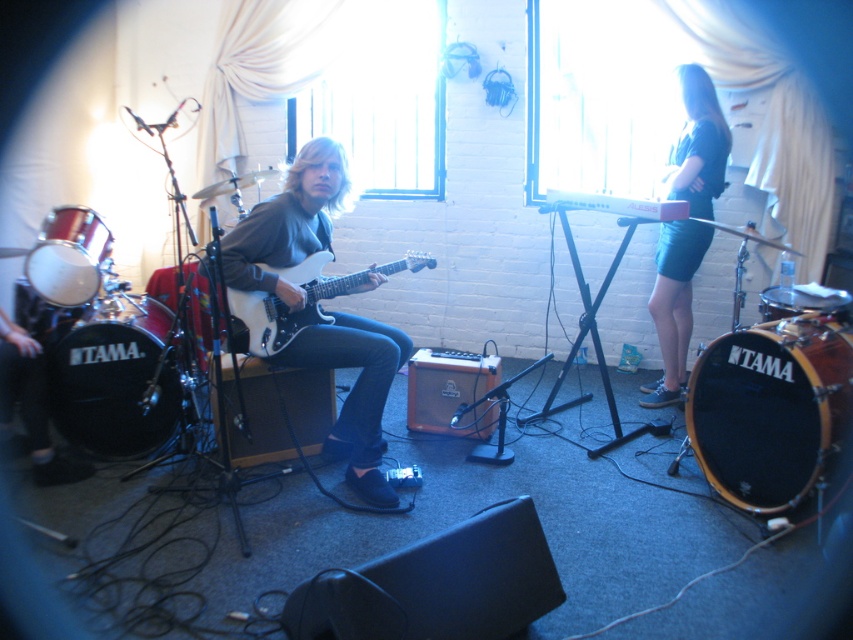
You are a photographer setting up a shoot in the room. You need to position a light source to the right of both the black drum at left and the glossy white electric guitar at center. Is this possible given their positions?

The black drum at left is located below the glossy white electric guitar at center, so positioning a light source to the right of both is possible as they are arranged vertically, allowing space to the right side.

You are a photographer setting up for a photoshoot in the room. You need to position a light source between the matte white guitar at center and the dark blue skirt at right. Which side of the guitar should the light be placed to ensure it illuminates the wider object properly?

The matte white guitar at center is wider than the dark blue skirt at right, so the light should be placed to the side of the matte white guitar at center to properly illuminate its wider surface.